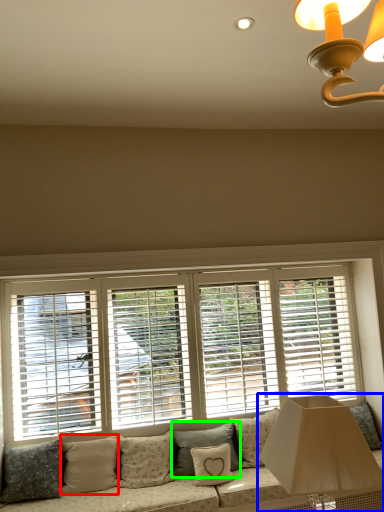
Question: Considering the real-world distances, which object is closest to pillow (highlighted by a red box)? table lamp (highlighted by a blue box) or pillow (highlighted by a green box).

Choices:
 (A) table lamp
 (B) pillow

Answer: (B)